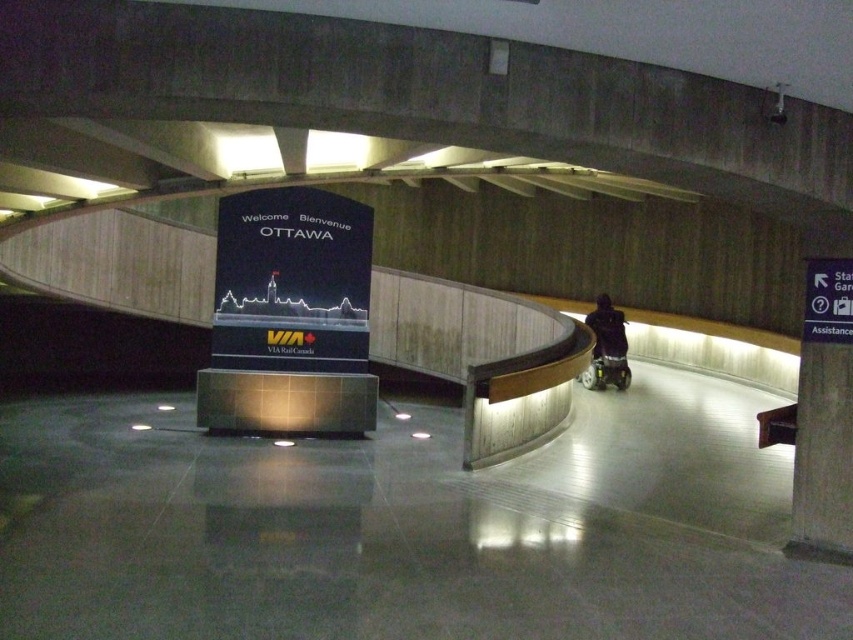
You are an airport security officer checking the dimensions of items. You see a dark blue jacket at center and a metallic silver baby carriage at lower right. Which item has a greater height?

The dark blue jacket at center has a larger size compared to metallic silver baby carriage at lower right, so the dark blue jacket at center is taller.

You are a traveler carrying a metallic silver baby carriage at lower right and need to reach the dark blue jacket at center. Which direction should you move to get closer to the jacket?

The dark blue jacket at center is positioned on the left side of the metallic silver baby carriage at lower right, so you should move to your left to get closer to the jacket.